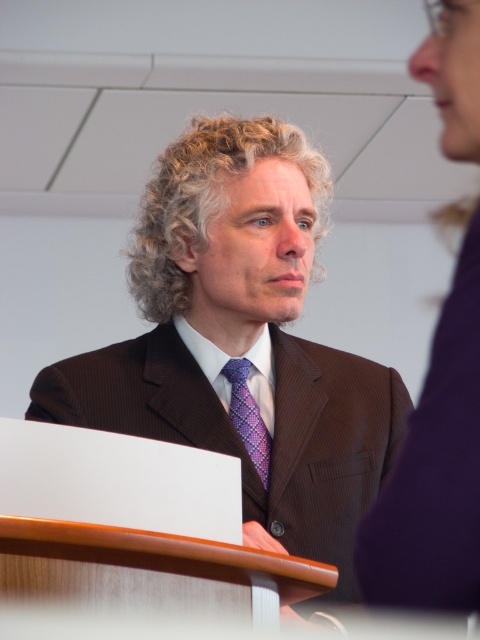
You are standing 6 feet away from the podium where the man with curly blonde hair at center is speaking. Can you hear him clearly without any electronic assistance?

The curly blonde hair at center is 5.34 feet away from the viewer, so you are standing 6 feet away from the podium. Since the distance between you and the speaker is only slightly more than the direct line of sight distance, you should be able to hear him clearly without needing electronic assistance.

Based on the scene description, where is the brown textured suit at center located in terms of its 2D coordinates?

The brown textured suit at center is located at the 2D coordinates of point (x=241, y=339).